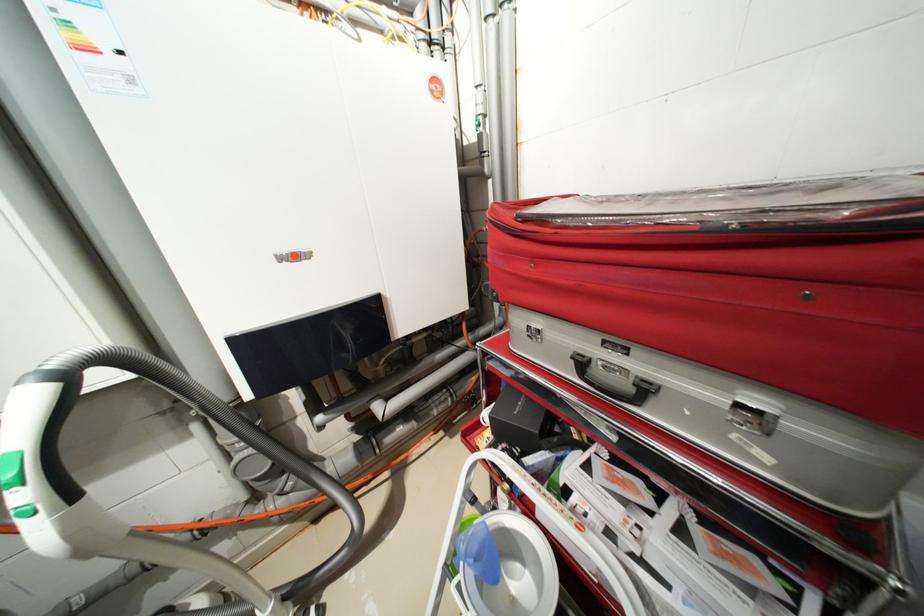
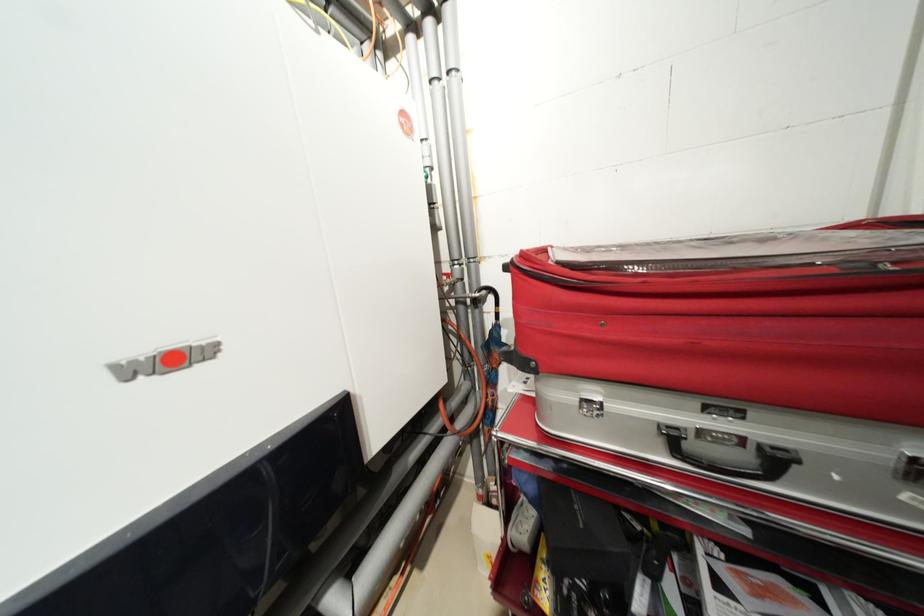
Question: Based on the continuous images, in which direction is the camera rotating? Reply with the corresponding letter.

Choices:
 (A) Left
 (B) Right
 (C) Up
 (D) Down

Answer: (B)